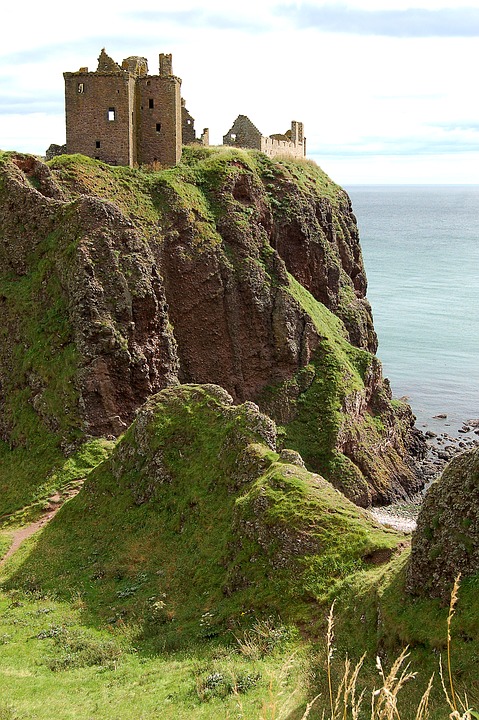
Where is `window`? This screenshot has height=720, width=479. window is located at coordinates (151, 106), (111, 112), (81, 88), (98, 140), (158, 127), (235, 138), (188, 121).